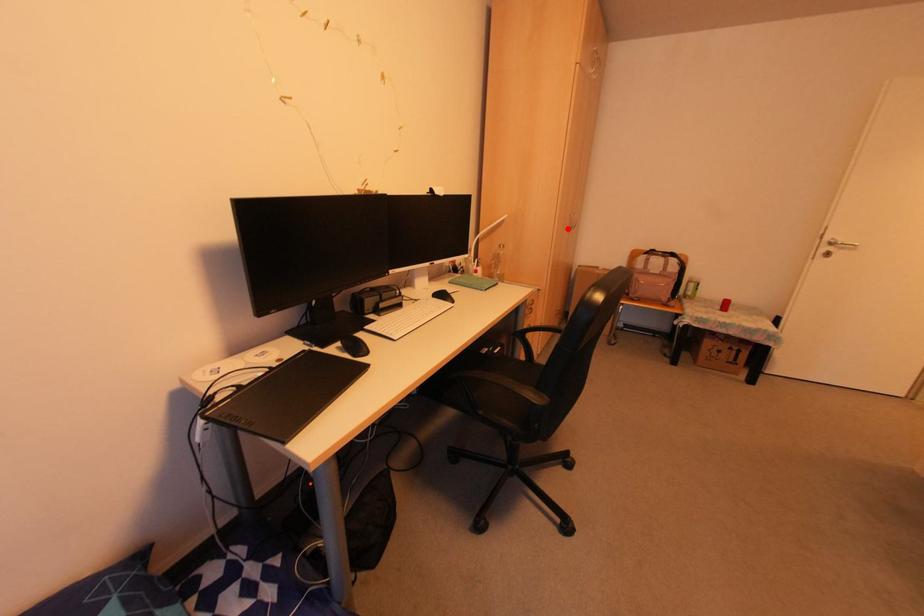
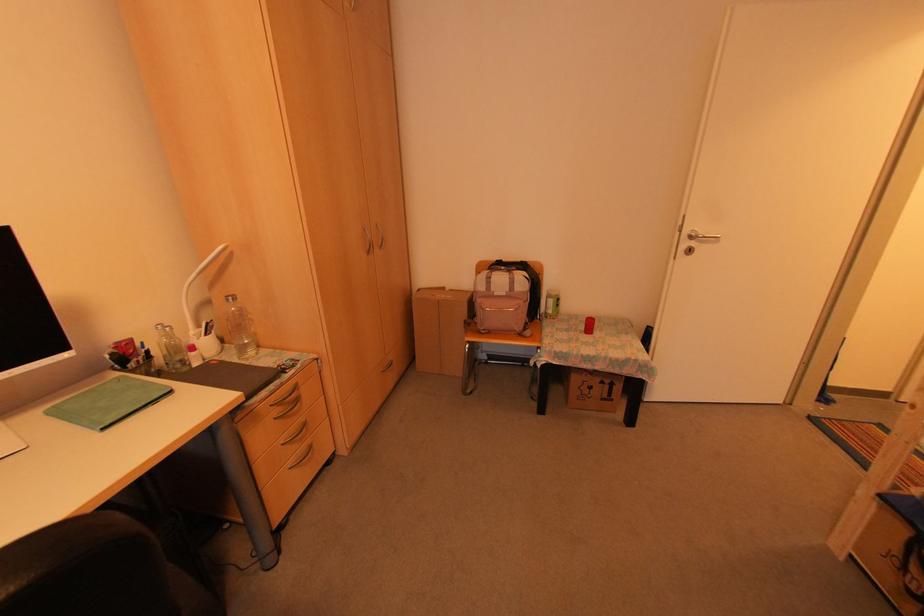
The point at the highlighted location is marked in the first image. Where is the corresponding point in the second image?

(366, 249)